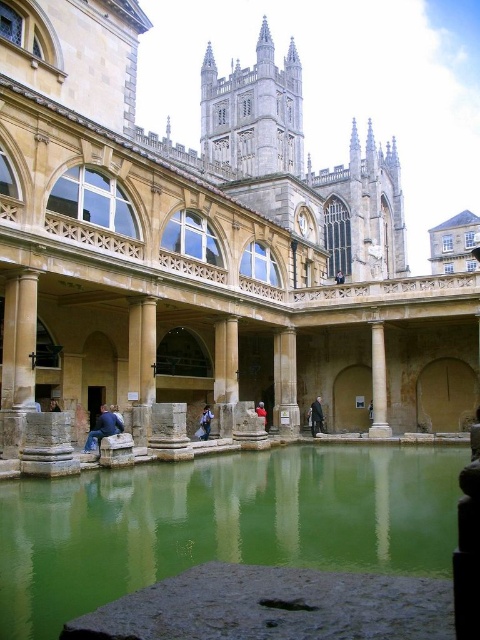
Question: Which object is positioned closest to the blue denim jeans at lower left?

Choices:
 (A) stone water at center
 (B) red velvet coat at center
 (C) blue jeans at center

Answer: (C)

Question: Which point appears farthest from the camera in this image?

Choices:
 (A) (149, 380)
 (B) (101, 416)

Answer: (A)

Question: Is green stone water at center below dark gray suit at center?

Choices:
 (A) no
 (B) yes

Answer: (B)

Question: Is green stone water at center above blue jeans at center?

Choices:
 (A) no
 (B) yes

Answer: (A)

Question: In this image, where is blue denim jeans at lower left located relative to red velvet coat at center?

Choices:
 (A) left
 (B) right

Answer: (A)

Question: Which of the following is the farthest from the observer?

Choices:
 (A) blue denim jeans at lower left
 (B) white marble column at center

Answer: (B)